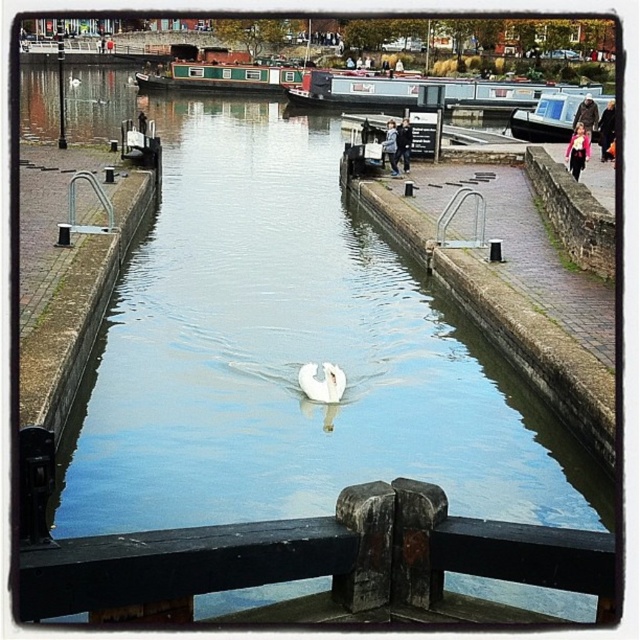
Can you confirm if green painted wood boat at upper center is smaller than white glossy swan at center?

No, green painted wood boat at upper center is not smaller than white glossy swan at center.

From the picture: Does green painted wood boat at upper center have a lesser height compared to white glossy swan at center?

No, green painted wood boat at upper center is not shorter than white glossy swan at center.

Describe the element at coordinates (218, 72) in the screenshot. The image size is (640, 640). I see `green painted wood boat at upper center` at that location.

Find the location of a particular element. The width and height of the screenshot is (640, 640). green painted wood boat at upper center is located at coordinates (218, 72).

Is green wooden barge at upper center bigger than green painted wood boat at upper center?

Yes.

Can you confirm if green wooden barge at upper center is positioned to the left of green painted wood boat at upper center?

Incorrect, green wooden barge at upper center is not on the left side of green painted wood boat at upper center.

Does point (323, 70) come closer to viewer compared to point (145, 76)?

That is True.

The height and width of the screenshot is (640, 640). In order to click on green wooden barge at upper center in this screenshot , I will do `click(419, 92)`.

Is black wood rail at center to the right of white plastic boat at right from the viewer's perspective?

Incorrect, black wood rail at center is not on the right side of white plastic boat at right.

Between point (241, 580) and point (588, 97), which one is positioned behind?

Positioned behind is point (588, 97).

Which is behind, point (230, 573) or point (557, 141)?

The point (557, 141) is behind.

The height and width of the screenshot is (640, 640). I want to click on black wood rail at center, so click(x=320, y=564).